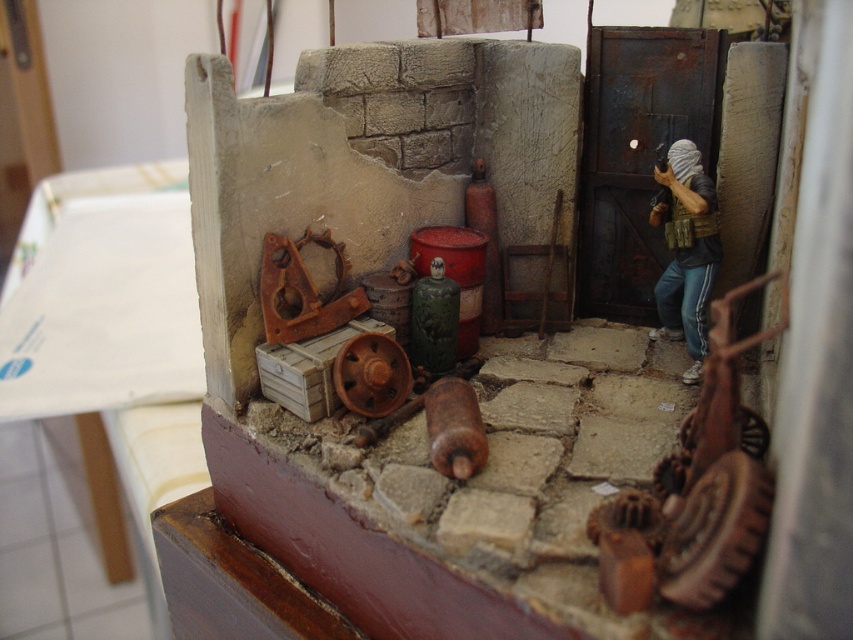
You are a small robot trying to navigate through the scene. You need to move from the wooden gear at lower right to the camouflage fabric figure at right. Is the path between them wide enough for you if you are 0.5 meters wide?

The wooden gear at lower right might be wider than camouflage fabric figure at right, so the path between them could be narrower than 0.5 meters. It might not be wide enough for the robot to pass safely.

You are standing in front of the diorama and want to know how far the point at coordinates (643, 524) is from you. Can you determine the distance in inches?

The point at coordinates (643, 524) is 32.60 inches away from the viewer.

You are a small robot exploring the diorama. You need to reach the camouflage fabric figure at right to deliver a message. However, there is a wooden gear at lower right in your path. Which object should you move first to clear the path?

You should move the wooden gear at lower right first because it is closer to you than the camouflage fabric figure at right, so it is blocking your path directly.